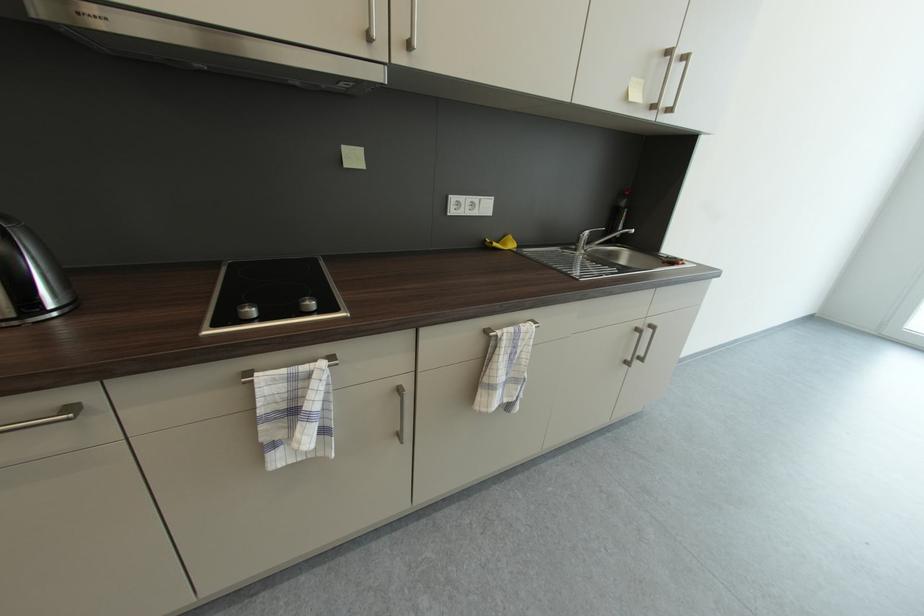
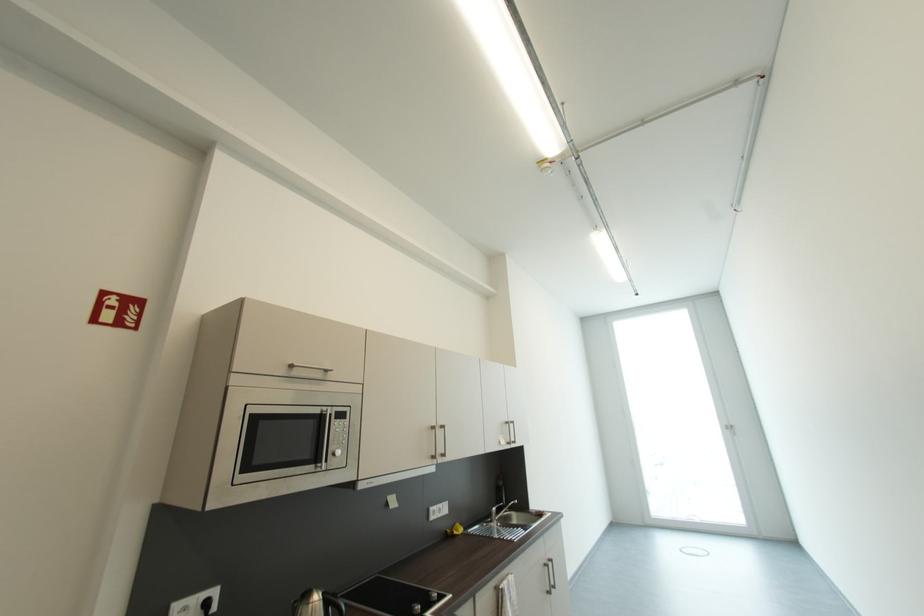
In the second image, find the point that corresponds to [492,243] in the first image.

(454, 533)